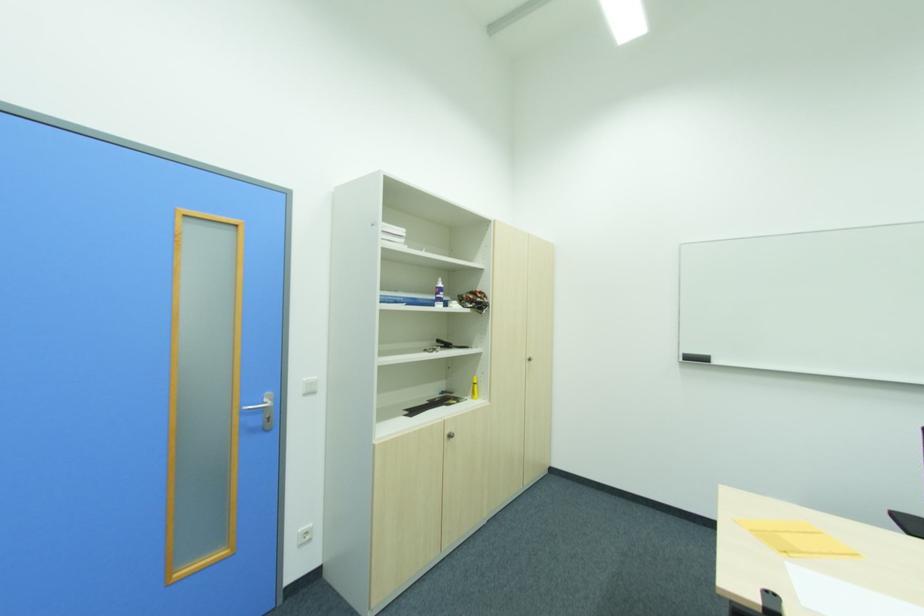
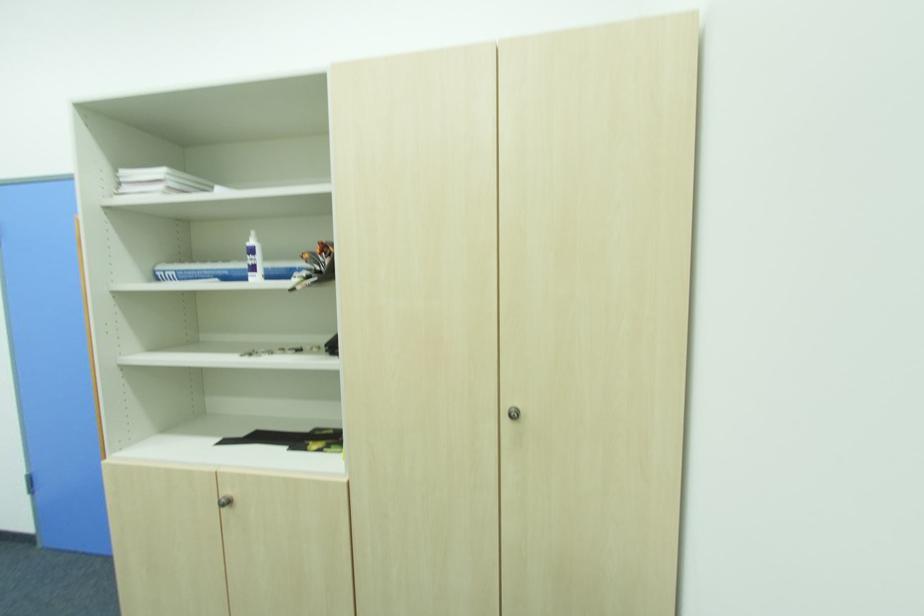
In the second image, find the point that corresponds to [405,232] in the first image.

(161, 172)